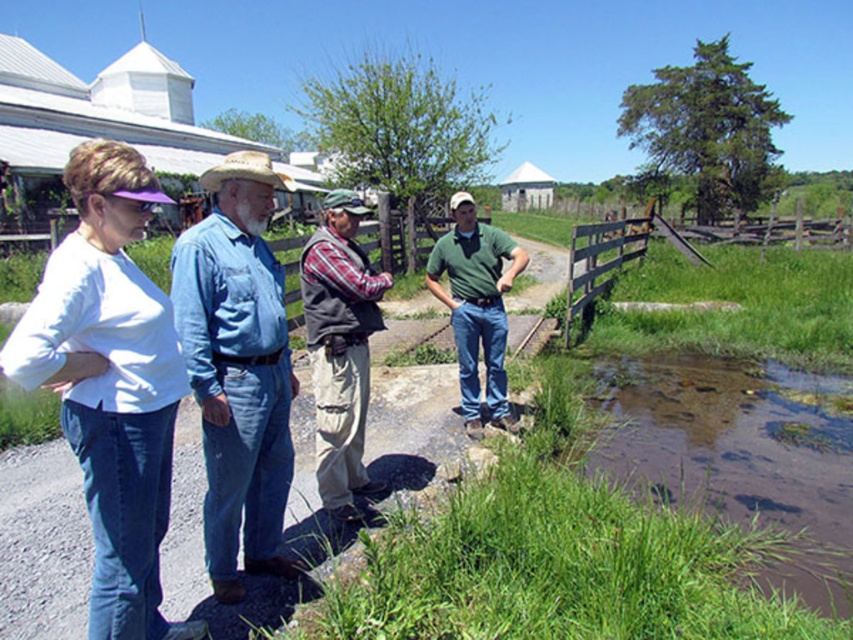
Question: Is plaid shirt vest at center positioned behind green matte shirt at center?

Choices:
 (A) yes
 (B) no

Answer: (B)

Question: Among these points, which one is nearest to the camera?

Choices:
 (A) (241, 484)
 (B) (816, 547)
 (C) (77, 234)

Answer: (C)

Question: Which object is positioned farthest from the brown wooden fence at right?

Choices:
 (A) green matte shirt at center
 (B) brown muddy water at lower right

Answer: (A)

Question: Among these points, which one is farthest from the camera?

Choices:
 (A) pos(91,625)
 (B) pos(743,278)
 (C) pos(601,456)

Answer: (B)

Question: From the image, what is the correct spatial relationship of plaid shirt vest at center in relation to light brown straw cowboy hat at center?

Choices:
 (A) right
 (B) left

Answer: (A)

Question: Can you confirm if white matte shirt at left is thinner than green matte shirt at center?

Choices:
 (A) yes
 (B) no

Answer: (A)